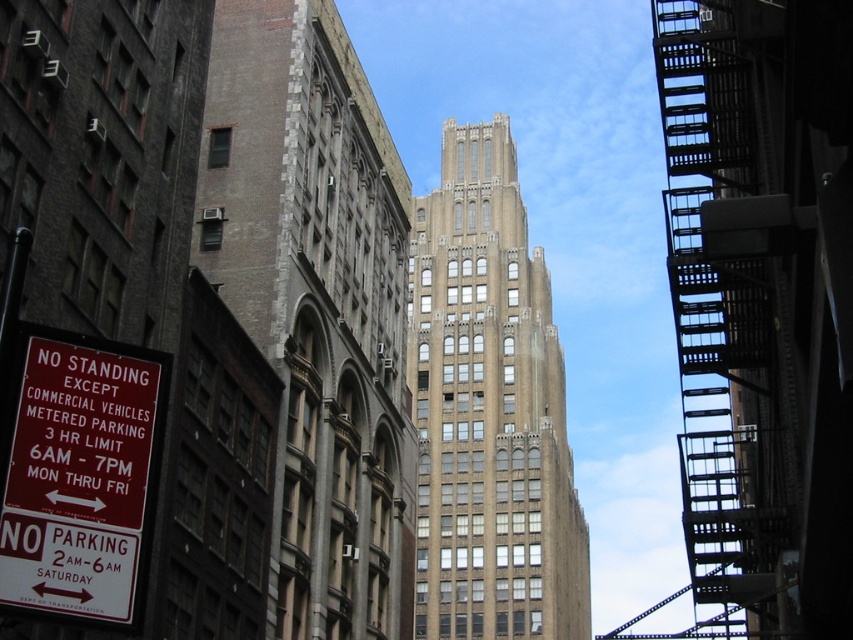
You are a city planner analyzing the cityscape. You need to determine which object is taller between the brown stone building at center and the red plastic sign at lower left. Based on the scene, which one is taller?

The brown stone building at center is taller than the red plastic sign at lower left.